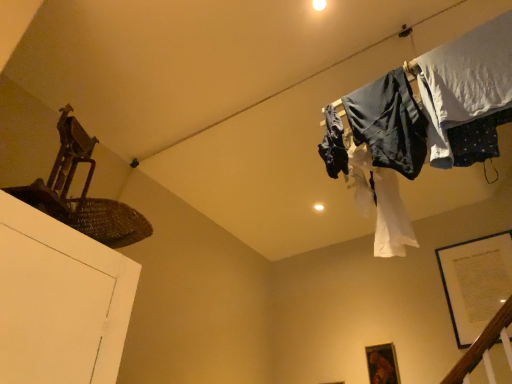
Question: From their relative heights in the image, would you say wooden frame at lower right is taller or shorter than dark blue fabric at upper right, the 2th clothing positioned from the left?

Choices:
 (A) short
 (B) tall

Answer: (A)

Question: From a real-world perspective, relative to dark blue fabric at upper right, the 2th clothing positioned from the left, is wooden frame at lower right vertically above or below?

Choices:
 (A) above
 (B) below

Answer: (B)

Question: Estimate the real-world distances between objects in this image. Which object is closer to the dark blue fabric at upper right, the second clothing when ordered from right to left?

Choices:
 (A) white fabric at upper right, the 3th clothing in the left-to-right sequence
 (B) wooden frame at lower right
 (C) dark blue fabric at upper right, acting as the first clothing starting from the left

Answer: (A)

Question: Which is farther from the dark blue fabric at upper right, the 2th clothing positioned from the left?

Choices:
 (A) wooden frame at lower right
 (B) dark blue fabric at upper right, acting as the first clothing starting from the left
 (C) white fabric at upper right, arranged as the first clothing when viewed from the right

Answer: (A)